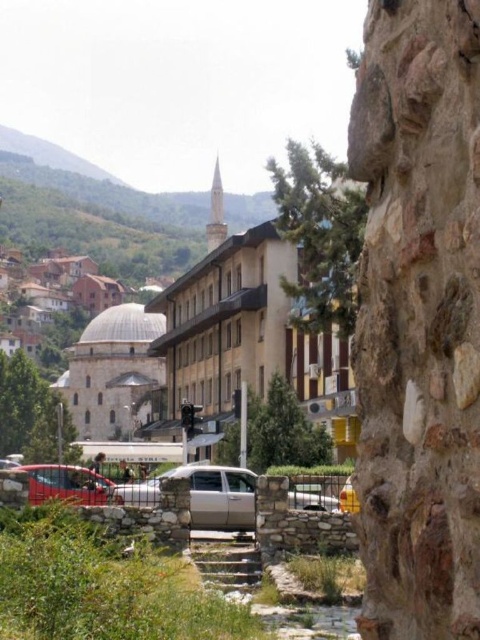
Is the position of beige stone mosque at center more distant than that of silver metallic sedan at center?

Yes.

Is point (278, 349) less distant than point (320, 508)?

No, it is not.

Image resolution: width=480 pixels, height=640 pixels. I want to click on beige stone mosque at center, so click(218, 346).

Can you confirm if beige stone mosque at center is smaller than metallic silver car at lower left?

Incorrect, beige stone mosque at center is not smaller in size than metallic silver car at lower left.

Between point (163, 362) and point (66, 484), which one is positioned behind?

Positioned behind is point (163, 362).

Describe the element at coordinates (218, 346) in the screenshot. I see `beige stone mosque at center` at that location.

This screenshot has height=640, width=480. What are the coordinates of `beige stone mosque at center` in the screenshot? It's located at (218, 346).

Which is above, silver metallic sedan at center or metallic silver car at lower left?

metallic silver car at lower left is above.

Can you confirm if silver metallic sedan at center is bigger than metallic silver car at lower left?

Correct, silver metallic sedan at center is larger in size than metallic silver car at lower left.

Who is more distant from viewer, (228, 499) or (36, 468)?

The point (36, 468) is behind.

Locate an element on the screen. The height and width of the screenshot is (640, 480). silver metallic sedan at center is located at coordinates (204, 493).